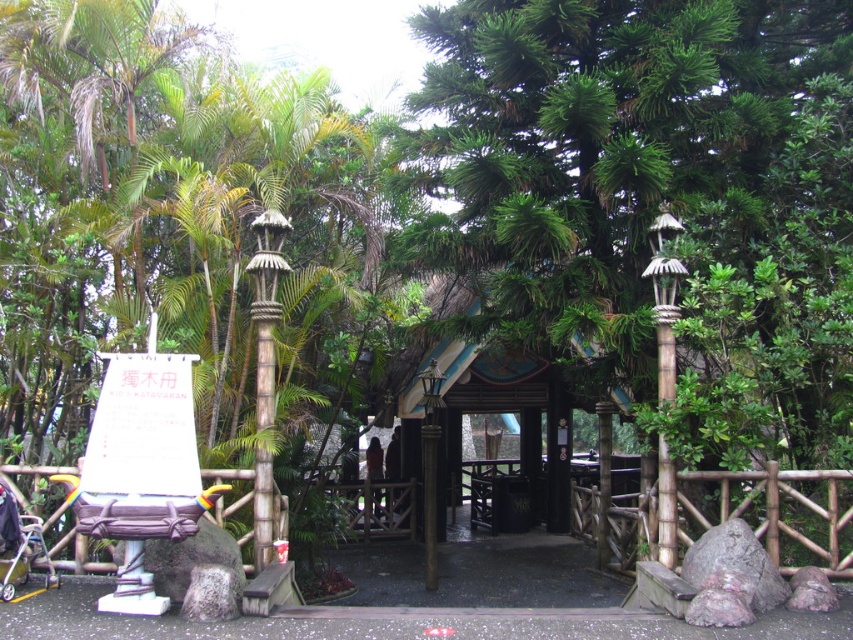
Is matte purple chair at center taller than metallic silver baby carriage at lower left?

Yes, matte purple chair at center is taller than metallic silver baby carriage at lower left.

Who is positioned more to the left, matte purple chair at center or metallic silver baby carriage at lower left?

metallic silver baby carriage at lower left

The height and width of the screenshot is (640, 853). What do you see at coordinates (136, 536) in the screenshot?
I see `matte purple chair at center` at bounding box center [136, 536].

The width and height of the screenshot is (853, 640). What are the coordinates of `matte purple chair at center` in the screenshot? It's located at 136,536.

Looking at this image, does matte purple chair at center come behind bamboo textured pole at center?

No, it is in front of bamboo textured pole at center.

Does matte purple chair at center have a smaller size compared to bamboo textured pole at center?

No, matte purple chair at center is not smaller than bamboo textured pole at center.

Who is more forward, (157, 611) or (259, 472)?

Point (157, 611) is more forward.

Find the location of a particular element. matte purple chair at center is located at coordinates (136, 536).

Does bamboo textured pole at center lie behind bamboo textured lamp post at right?

Yes, bamboo textured pole at center is further from the viewer.

Is bamboo textured pole at center to the right of bamboo textured lamp post at right from the viewer's perspective?

No, bamboo textured pole at center is not to the right of bamboo textured lamp post at right.

Is point (270, 356) less distant than point (675, 513)?

That is False.

In order to click on bamboo textured pole at center in this screenshot , I will do `click(265, 307)`.